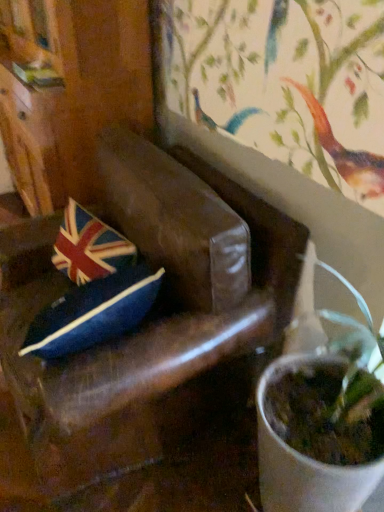
What is the approximate width of brown leather chair at center?

brown leather chair at center is 35.22 inches in width.

This screenshot has height=512, width=384. I want to click on brown leather chair at center, so click(x=149, y=352).

What is the approximate height of brown leather chair at center?

brown leather chair at center is 36.44 inches tall.

The image size is (384, 512). What do you see at coordinates (149, 352) in the screenshot?
I see `brown leather chair at center` at bounding box center [149, 352].

Identify the location of velvet union jack pillow at center. (89, 246).

What do you see at coordinates (89, 246) in the screenshot? I see `velvet union jack pillow at center` at bounding box center [89, 246].

At what (x,y) coordinates should I click in order to perform the action: click on brown leather chair at center. Please return your answer as a coordinate pair (x, y). Looking at the image, I should click on (149, 352).

In the image, is brown leather chair at center on the left side or the right side of velvet union jack pillow at center?

brown leather chair at center is to the right of velvet union jack pillow at center.

Is the depth of brown leather chair at center greater than that of velvet union jack pillow at center?

No.

Between point (225, 397) and point (52, 258), which one is positioned behind?

The point (52, 258) is behind.

From the image's perspective, who appears lower, brown leather chair at center or velvet union jack pillow at center?

brown leather chair at center is shown below in the image.

From a real-world perspective, relative to velvet union jack pillow at center, is brown leather chair at center vertically above or below?

From a real-world perspective, brown leather chair at center is physically below velvet union jack pillow at center.

Is brown leather chair at center wider than velvet union jack pillow at center?

Correct, the width of brown leather chair at center exceeds that of velvet union jack pillow at center.

Is brown leather chair at center shorter than velvet union jack pillow at center?

In fact, brown leather chair at center may be taller than velvet union jack pillow at center.

Does brown leather chair at center have a smaller size compared to velvet union jack pillow at center?

Incorrect, brown leather chair at center is not smaller in size than velvet union jack pillow at center.

Is velvet union jack pillow at center inside brown leather chair at center?

Yes, velvet union jack pillow at center can be found within brown leather chair at center.

Does brown leather chair at center touch velvet union jack pillow at center?

brown leather chair at center and velvet union jack pillow at center are not in contact.

Is velvet union jack pillow at center at the back of brown leather chair at center?

Yes, brown leather chair at center's orientation is away from velvet union jack pillow at center.

This screenshot has height=512, width=384. I want to click on chair below the velvet union jack pillow at center (from a real-world perspective), so click(x=149, y=352).

Is velvet union jack pillow at center to the right of brown leather chair at center from the viewer's perspective?

No, velvet union jack pillow at center is not to the right of brown leather chair at center.

In the image, is velvet union jack pillow at center positioned in front of or behind brown leather chair at center?

In the image, velvet union jack pillow at center appears behind brown leather chair at center.

Is point (77, 278) farther from viewer compared to point (231, 356)?

Yes.

From the image's perspective, is velvet union jack pillow at center above brown leather chair at center?

Yes, from the image's perspective, velvet union jack pillow at center is over brown leather chair at center.

From a real-world perspective, which is physically above, velvet union jack pillow at center or brown leather chair at center?

velvet union jack pillow at center, from a real-world perspective.

Considering the relative sizes of velvet union jack pillow at center and brown leather chair at center in the image provided, is velvet union jack pillow at center wider than brown leather chair at center?

Result: Incorrect, the width of velvet union jack pillow at center does not surpass that of brown leather chair at center.

Who is taller, velvet union jack pillow at center or brown leather chair at center?

brown leather chair at center.

Who is bigger, velvet union jack pillow at center or brown leather chair at center?

brown leather chair at center is bigger.

Is velvet union jack pillow at center inside the boundaries of brown leather chair at center, or outside?

velvet union jack pillow at center is located inside brown leather chair at center.

Are velvet union jack pillow at center and brown leather chair at center beside each other?

No, velvet union jack pillow at center is not touching brown leather chair at center.

Is velvet union jack pillow at center oriented away from brown leather chair at center?

Yes, velvet union jack pillow at center is positioned with its back facing brown leather chair at center.

This screenshot has height=512, width=384. Find the location of `chair in front of the velvet union jack pillow at center`. chair in front of the velvet union jack pillow at center is located at coordinates (149, 352).

The width and height of the screenshot is (384, 512). What are the coordinates of `chair on the right of velvet union jack pillow at center` in the screenshot? It's located at (149, 352).

Find the location of a particular element. The height and width of the screenshot is (512, 384). flag on the left of the brown leather chair at center is located at coordinates (89, 246).